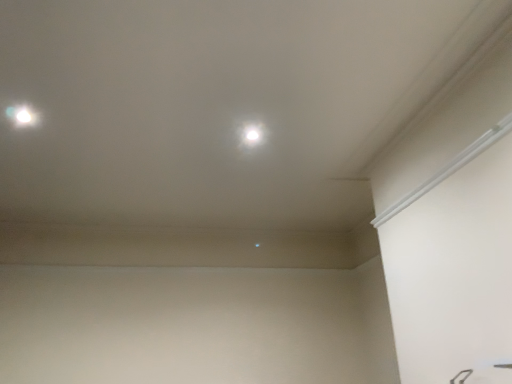
Question: Is the depth of white glossy dot at center, the 1th dot in the bottom-to-top sequence, less than that of white glossy light at upper left, which is counted as the first dot, starting from the front?

Choices:
 (A) no
 (B) yes

Answer: (A)

Question: Could you tell me if white glossy dot at center, marked as the second dot in a left-to-right arrangement, is facing white glossy light at upper left, marked as the 2th dot in a bottom-to-top arrangement?

Choices:
 (A) no
 (B) yes

Answer: (A)

Question: Does white glossy dot at center, positioned as the second dot in top-to-bottom order, have a smaller size compared to white glossy light at upper left, acting as the second dot starting from the right?

Choices:
 (A) no
 (B) yes

Answer: (A)

Question: From a real-world perspective, is white glossy dot at center, which ranks as the second dot in front-to-back order, below white glossy light at upper left, acting as the second dot starting from the right?

Choices:
 (A) yes
 (B) no

Answer: (B)

Question: Would you say white glossy dot at center, positioned as the second dot in top-to-bottom order, contains white glossy light at upper left, which is counted as the first dot, starting from the front?

Choices:
 (A) yes
 (B) no

Answer: (B)

Question: Is white glossy dot at center, the 1th dot in the bottom-to-top sequence, shorter than white glossy light at upper left, which appears as the second dot when viewed from the back?

Choices:
 (A) yes
 (B) no

Answer: (B)

Question: Is white glossy dot at center, the 1th dot in the bottom-to-top sequence, completely or partially inside white glossy light at upper left, acting as the second dot starting from the right?

Choices:
 (A) yes
 (B) no

Answer: (B)

Question: From a real-world perspective, is white glossy light at upper left, which is counted as the first dot, starting from the front, on top of white glossy dot at center, arranged as the first dot when viewed from the right?

Choices:
 (A) no
 (B) yes

Answer: (A)

Question: Can you confirm if white glossy light at upper left, which is counted as the first dot, starting from the front, is wider than white glossy dot at center, which ranks as the second dot in front-to-back order?

Choices:
 (A) yes
 (B) no

Answer: (B)

Question: Is white glossy light at upper left, which is counted as the first dot, starting from the front, behind white glossy dot at center, arranged as the first dot when viewed from the right?

Choices:
 (A) yes
 (B) no

Answer: (B)

Question: Can you confirm if white glossy light at upper left, acting as the second dot starting from the right, is taller than white glossy dot at center, the first dot viewed from the back?

Choices:
 (A) yes
 (B) no

Answer: (B)

Question: Would you say white glossy light at upper left, acting as the second dot starting from the right, is outside white glossy dot at center, positioned as the second dot in top-to-bottom order?

Choices:
 (A) yes
 (B) no

Answer: (A)

Question: From the image's perspective, is white glossy light at upper left, which appears as the second dot when viewed from the back, above or below white glossy dot at center, the 1th dot in the bottom-to-top sequence?

Choices:
 (A) above
 (B) below

Answer: (A)